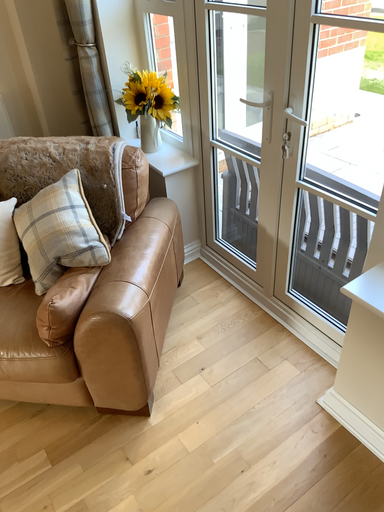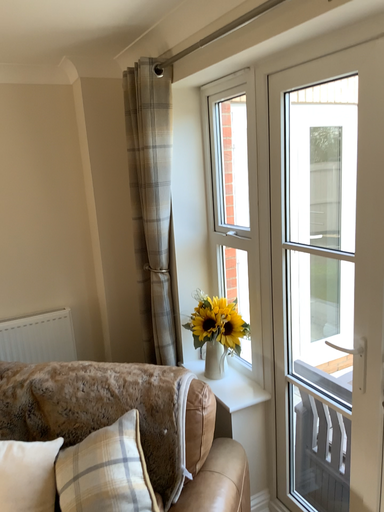
Question: Which way did the camera rotate in the video?

Choices:
 (A) rotated upward
 (B) rotated downward

Answer: (A)